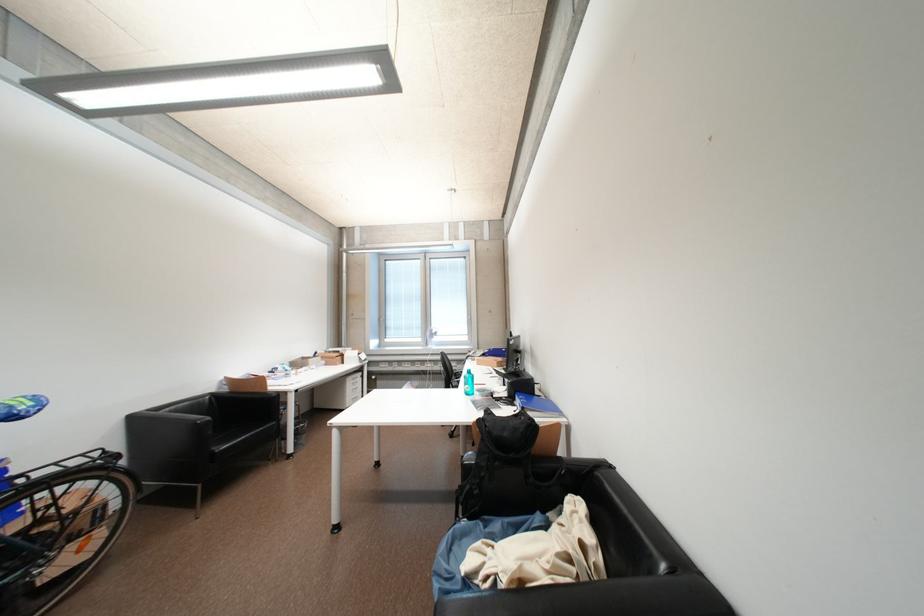
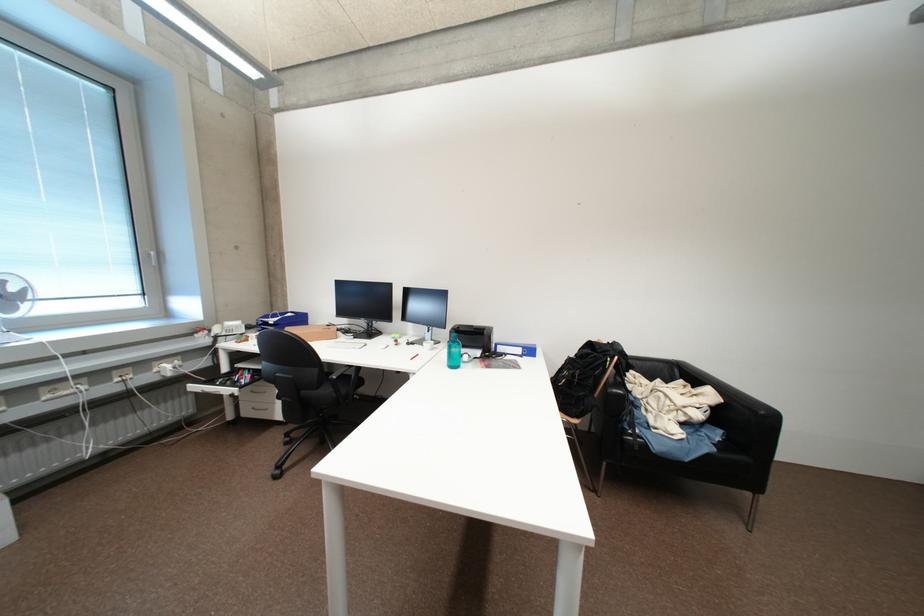
Locate, in the second image, the point that corresponds to (x=479, y=355) in the first image.

(225, 331)